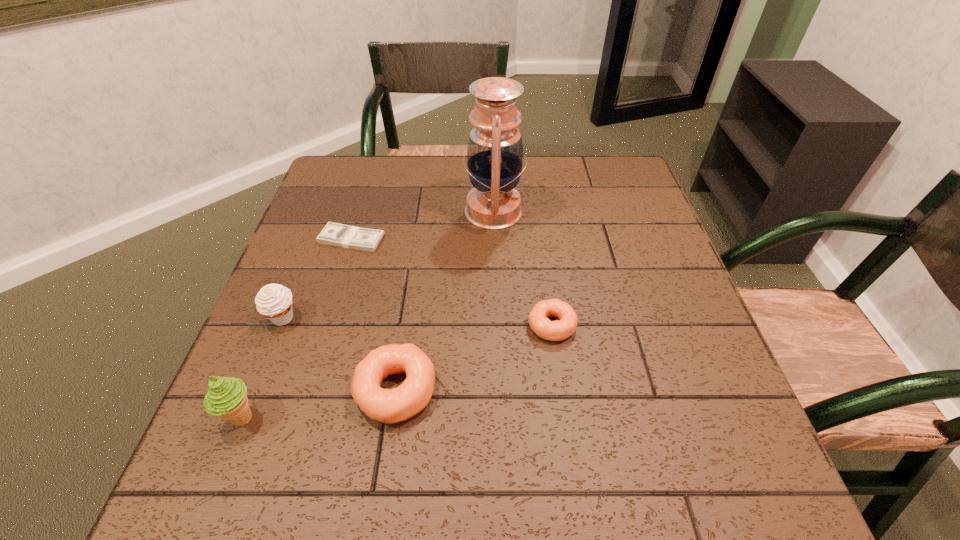
All doughnuts are currently evenly spaced. To continue this pattern, where would you add another doughnut on the right? Please point out a vacant spot. Please provide its 2D coordinates. Your answer should be formatted as a tuple, i.e. [(x, y)], where the tuple contains the x and y coordinates of a point satisfying the conditions above.

[(676, 274)]